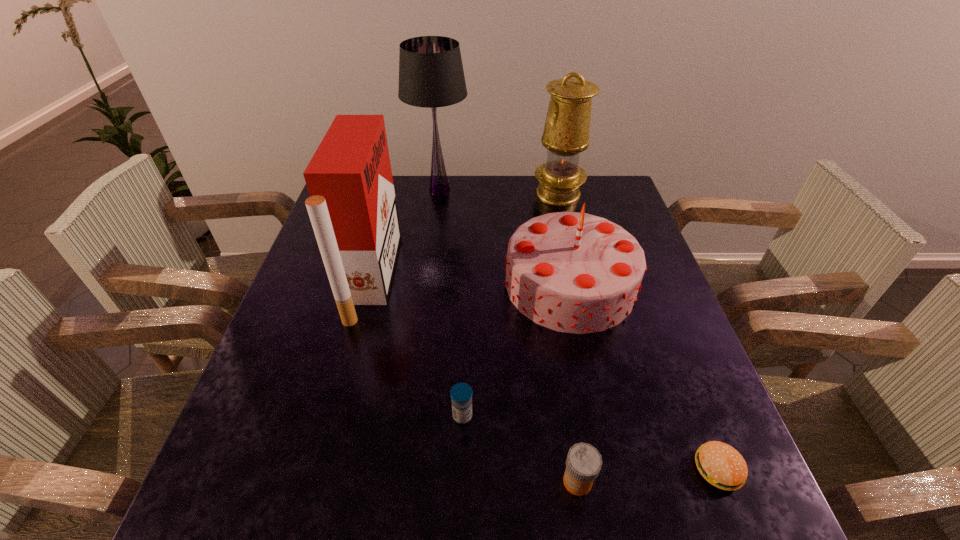
Identify the location of free space located on the front-facing side of the cigarette case. (424, 276).

You are a GUI agent. You are given a task and a screenshot of the screen. Output one action in this format:
    pyautogui.click(x=<x>, y=<y>)
    Task: Click on the blank space located 0.230m on the back of the fourth shortest object
    The height and width of the screenshot is (540, 960).
    Given the screenshot: What is the action you would take?
    pyautogui.click(x=551, y=198)

Identify the location of vacant region located 0.050m on the label side of the right medicine. The height and width of the screenshot is (540, 960). (533, 481).

Where is `vacant space located on the label side of the right medicine`? vacant space located on the label side of the right medicine is located at coordinates pyautogui.click(x=527, y=481).

Where is `vacant region located on the label side of the right medicine`? The image size is (960, 540). vacant region located on the label side of the right medicine is located at coordinates (405, 481).

Where is `free spot located 0.240m on the back of the left medicine`? The image size is (960, 540). free spot located 0.240m on the back of the left medicine is located at coordinates (466, 315).

Identify the location of free point located 0.400m on the back of the shortest object. The image size is (960, 540). (648, 292).

Identify the location of lampshade that is positioned at the far edge. The image size is (960, 540). (431, 75).

What are the coordinates of `oil lamp that is at the far edge` in the screenshot? It's located at (566, 133).

Where is `medicine that is at the near edge`? The width and height of the screenshot is (960, 540). medicine that is at the near edge is located at coordinates (583, 463).